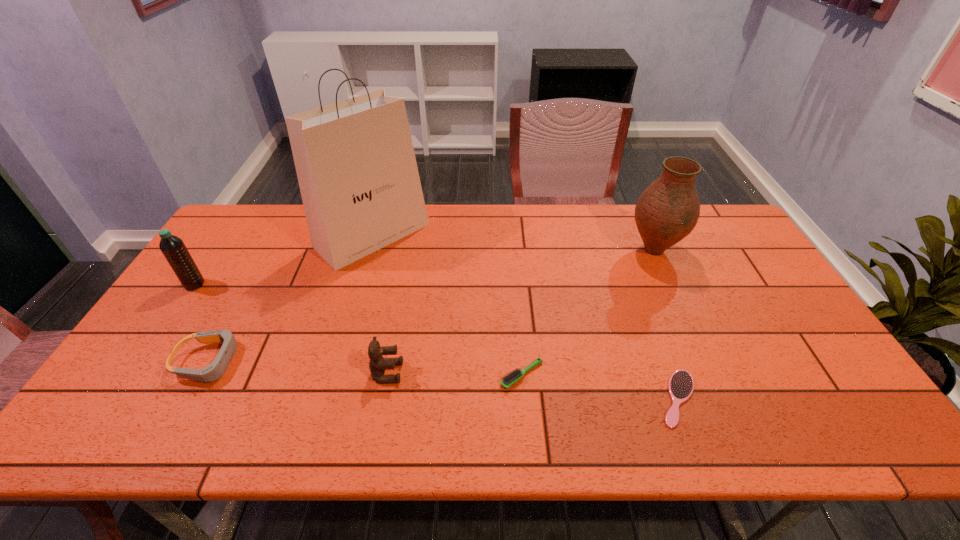
The image size is (960, 540). I want to click on empty space that is in between the water bottle and the teddy bear, so click(291, 328).

You are a GUI agent. You are given a task and a screenshot of the screen. Output one action in this format:
    pyautogui.click(x=<x>, y=<y>)
    Task: Click on the vacant area between the fifth tallest object and the leftmost object
    The height and width of the screenshot is (540, 960).
    Given the screenshot: What is the action you would take?
    pyautogui.click(x=202, y=323)

Find the location of a particular element. The height and width of the screenshot is (540, 960). free point between the leftmost object and the fifth tallest object is located at coordinates (202, 323).

I want to click on free area in between the sixth object from right to left and the second tallest object, so click(431, 306).

Identify the location of empty space that is in between the water bottle and the sixth shortest object. (424, 267).

The image size is (960, 540). Identify the location of free area in between the fourth shortest object and the right hairbrush. (533, 386).

Where is `the third closest object to the sixth shortest object`? the third closest object to the sixth shortest object is located at coordinates (355, 162).

Identify which object is the third nearest to the sixth shortest object. Please provide its 2D coordinates. Your answer should be formatted as a tuple, i.e. [(x, y)], where the tuple contains the x and y coordinates of a point satisfying the conditions above.

[(355, 162)]

Locate an element on the screen. free location that satisfies the following two spatial constraints: 1. on the back side of the second tallest object; 2. on the left side of the third object from right to left is located at coordinates (512, 250).

You are a GUI agent. You are given a task and a screenshot of the screen. Output one action in this format:
    pyautogui.click(x=<x>, y=<y>)
    Task: Click on the vacant area in the image that satisfies the following two spatial constraints: 1. on the front and back of the fifth object from left to right; 2. on the left side of the fifth tallest object
    Image resolution: width=960 pixels, height=540 pixels.
    Given the screenshot: What is the action you would take?
    pyautogui.click(x=202, y=375)